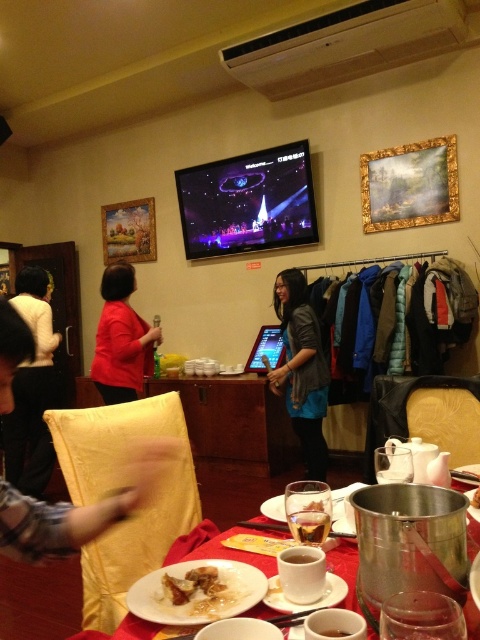
From the picture: Can you confirm if matte red shirt at center is positioned to the right of slightly browned meat at center?

No, matte red shirt at center is not to the right of slightly browned meat at center.

Between point (126, 337) and point (200, 605), which one is positioned behind?

Point (126, 337)

Who is more distant from viewer, (132, 320) or (173, 586)?

The point (132, 320) is more distant.

This screenshot has width=480, height=640. In order to click on matte red shirt at center in this screenshot , I will do `click(121, 339)`.

Between point (147, 360) and point (470, 500), which one is positioned behind?

Point (147, 360)

Which is below, matte red shirt at center or white ceramic plate at center?

Positioned lower is white ceramic plate at center.

Is point (120, 336) closer to camera compared to point (477, 509)?

No, (120, 336) is behind (477, 509).

This screenshot has width=480, height=640. What are the coordinates of `matte red shirt at center` in the screenshot? It's located at (121, 339).

Is the position of matte black jacket at center more distant than that of matte red shirt at center?

Yes, it is.

Does point (288, 408) come farther from viewer compared to point (111, 326)?

Yes, point (288, 408) is farther from viewer.

In order to click on matte black jacket at center in this screenshot , I will do `click(301, 369)`.

This screenshot has height=640, width=480. I want to click on matte black jacket at center, so click(301, 369).